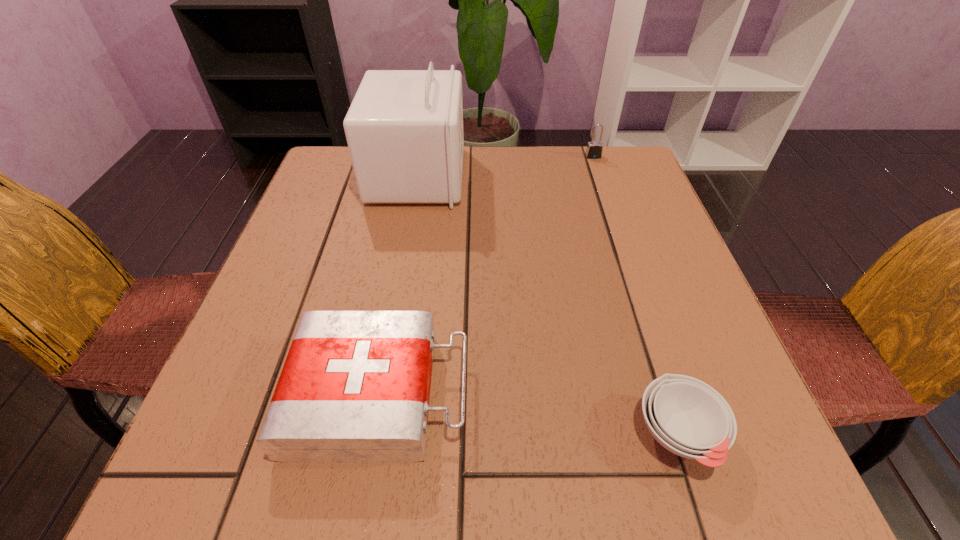
At what (x,y) coordinates should I click in order to perform the action: click on the tallest object. Please return your answer as a coordinate pair (x, y). This screenshot has height=540, width=960. Looking at the image, I should click on (404, 129).

This screenshot has height=540, width=960. Identify the location of the taller first-aid kit. (404, 129).

Where is `the second tallest object`? This screenshot has width=960, height=540. the second tallest object is located at coordinates (594, 149).

At what (x,y) coordinates should I click in order to perform the action: click on the nearer first-aid kit. Please return your answer as a coordinate pair (x, y). The width and height of the screenshot is (960, 540). Looking at the image, I should click on (355, 387).

At what (x,y) coordinates should I click in order to perform the action: click on the third tallest object. Please return your answer as a coordinate pair (x, y). Looking at the image, I should click on (355, 387).

You are a GUI agent. You are given a task and a screenshot of the screen. Output one action in this format:
    pyautogui.click(x=<x>, y=<y>)
    Task: Click on the soup bowl
    This screenshot has height=540, width=960.
    Given the screenshot: What is the action you would take?
    pyautogui.click(x=689, y=418)

At what (x,y) coordinates should I click in order to perform the action: click on vacant space located 0.100m on the front-facing side of the farther first-aid kit. Please return your answer as a coordinate pair (x, y). The height and width of the screenshot is (540, 960). Looking at the image, I should click on [x=502, y=176].

Find the location of a particular element. The width and height of the screenshot is (960, 540). free region located on the shackle of the third shortest object is located at coordinates (614, 221).

I want to click on free space located 0.360m on the front side of the shorter first-aid kit, so click(697, 394).

Identify the location of vacant space located on the back of the soup bowl. (656, 364).